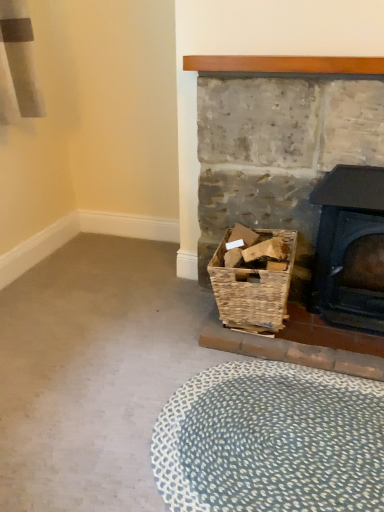
The height and width of the screenshot is (512, 384). I want to click on free spot above blue textured rug at lower center (from a real-world perspective), so click(x=268, y=432).